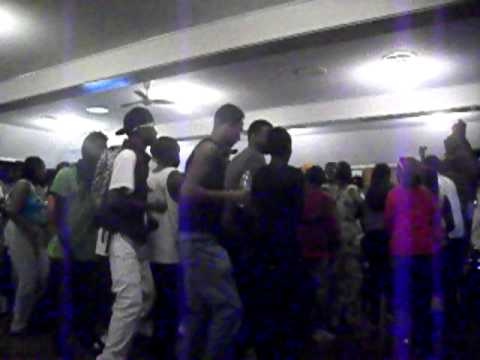
Image resolution: width=480 pixels, height=360 pixels. What are the coordinates of `ceiling` in the screenshot? It's located at (175, 35).